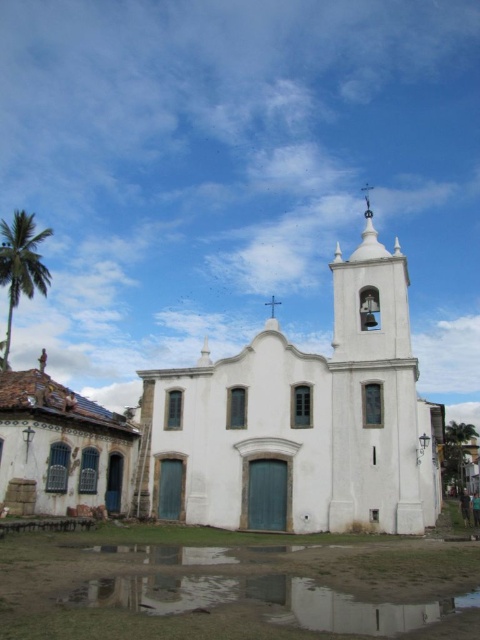
In the scene shown: You are standing in front of the historic white church and notice two structures. One is the white stucco chapel at center and the other is the rustic clay roof tiles at lower left. Which structure is positioned higher in the image?

The white stucco chapel at center is located above the rustic clay roof tiles at lower left, so it is positioned higher in the image.

You are standing in front of the historic white church and notice the rustic clay roof tiles at lower left and the green leafy palm tree at left. From your perspective, which object is closer to the right side of the palm tree?

The rustic clay roof tiles at lower left are positioned on the right side of the green leafy palm tree at left, so they are closer to the right side of the palm tree.

You are standing in the middle of a square facing the white stucco chapel at center and the rustic clay roof tiles at lower left. Which building is closer to your left side?

The rustic clay roof tiles at lower left are closer to your left side since the white stucco chapel at center is positioned to the right of them.